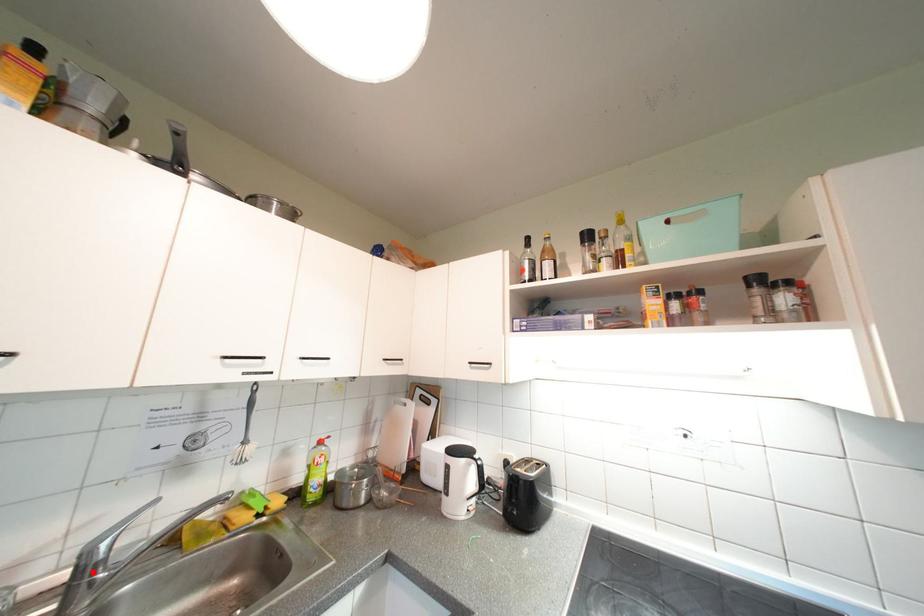
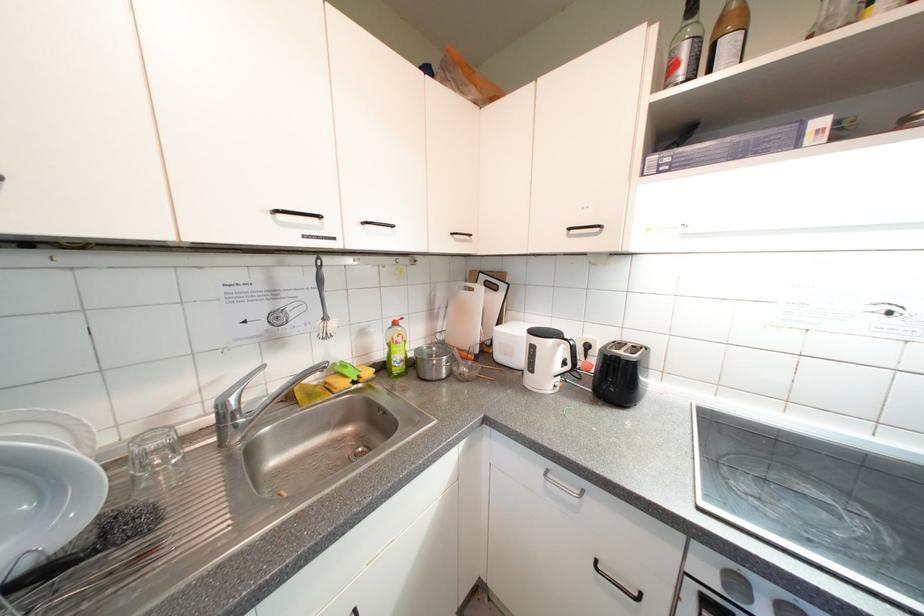
Find the pixel in the second image that matches the highlighted location in the first image.

(233, 419)